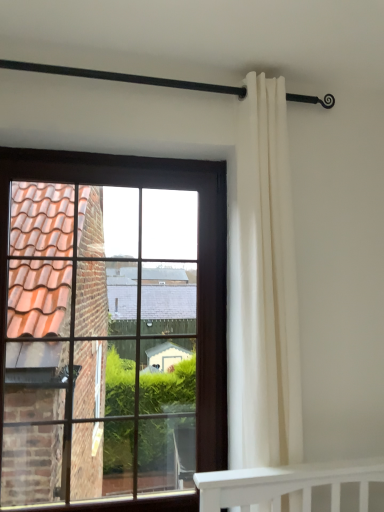
Question: Is brown wooden window at left positioned beyond the bounds of black metal rod at upper center?

Choices:
 (A) yes
 (B) no

Answer: (A)

Question: Is brown wooden window at left touching black metal rod at upper center?

Choices:
 (A) no
 (B) yes

Answer: (A)

Question: Is black metal rod at upper center completely or partially inside brown wooden window at left?

Choices:
 (A) yes
 (B) no

Answer: (B)

Question: Are brown wooden window at left and black metal rod at upper center far apart?

Choices:
 (A) no
 (B) yes

Answer: (B)

Question: Considering the relative sizes of brown wooden window at left and black metal rod at upper center in the image provided, is brown wooden window at left bigger than black metal rod at upper center?

Choices:
 (A) no
 (B) yes

Answer: (B)

Question: From a real-world perspective, is brown wooden window at left physically located above or below white fabric curtain at right?

Choices:
 (A) above
 (B) below

Answer: (B)

Question: In terms of width, does brown wooden window at left look wider or thinner when compared to white fabric curtain at right?

Choices:
 (A) thin
 (B) wide

Answer: (A)

Question: Choose the correct answer: Is brown wooden window at left inside white fabric curtain at right or outside it?

Choices:
 (A) outside
 (B) inside

Answer: (A)

Question: From the image's perspective, is brown wooden window at left above or below white fabric curtain at right?

Choices:
 (A) above
 (B) below

Answer: (B)

Question: From the image's perspective, is black metal rod at upper center above or below white fabric curtain at right?

Choices:
 (A) above
 (B) below

Answer: (A)

Question: In terms of width, does black metal rod at upper center look wider or thinner when compared to white fabric curtain at right?

Choices:
 (A) wide
 (B) thin

Answer: (B)

Question: Considering the positions of black metal rod at upper center and white fabric curtain at right in the image, is black metal rod at upper center taller or shorter than white fabric curtain at right?

Choices:
 (A) tall
 (B) short

Answer: (B)

Question: Considering the positions of point click(56, 67) and point click(284, 101), is point click(56, 67) closer or farther from the camera than point click(284, 101)?

Choices:
 (A) closer
 (B) farther

Answer: (A)

Question: Considering the positions of brown wooden window at left and black metal rod at upper center in the image, is brown wooden window at left bigger or smaller than black metal rod at upper center?

Choices:
 (A) small
 (B) big

Answer: (B)

Question: Considering their positions, is brown wooden window at left located in front of or behind black metal rod at upper center?

Choices:
 (A) front
 (B) behind

Answer: (B)